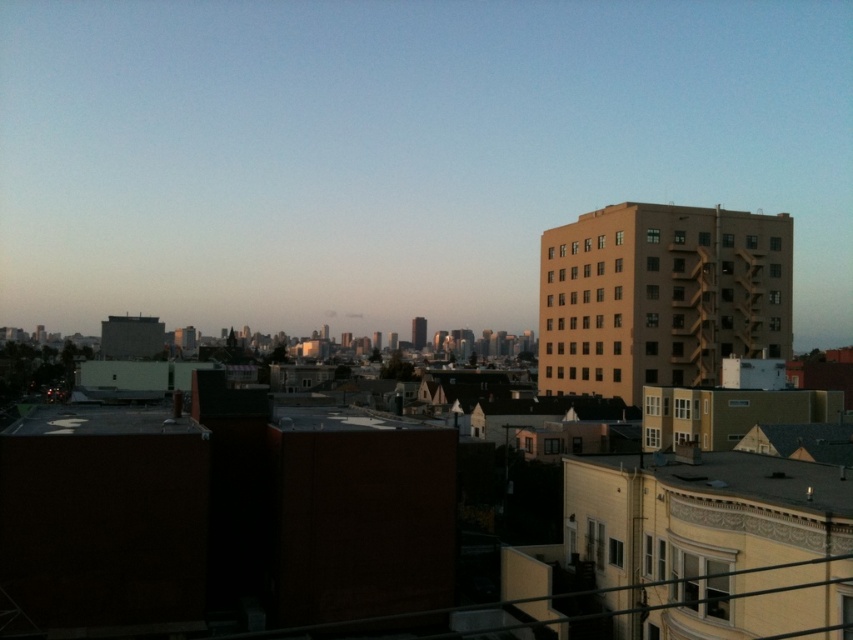
Does point (288, 44) come farther from viewer compared to point (621, 228)?

Yes.

Is point (114, 99) positioned after point (703, 240)?

Yes, point (114, 99) is behind point (703, 240).

This screenshot has width=853, height=640. Find the location of `matte brown building at right`. matte brown building at right is located at coordinates (398, 150).